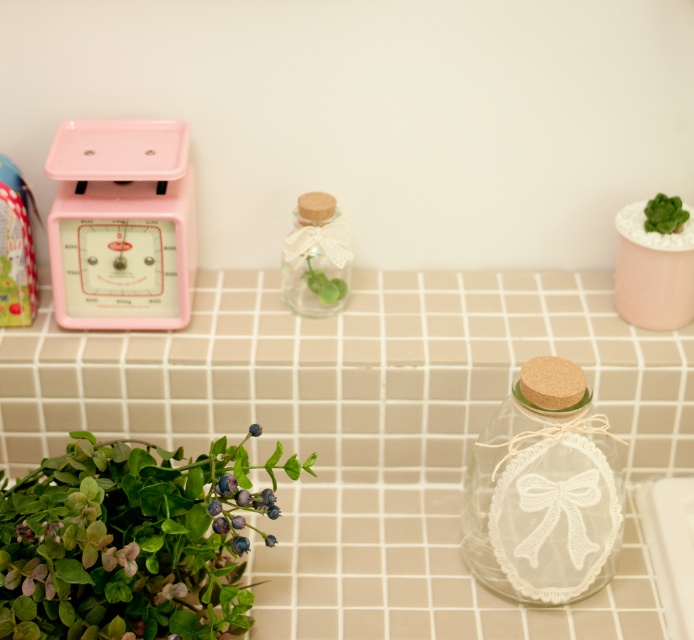
Question: Does green matte plant at lower left have a larger size compared to clear glass bottle at center?

Choices:
 (A) no
 (B) yes

Answer: (B)

Question: Which object is farther from the camera taking this photo?

Choices:
 (A) transparent glass jar with lace bow at center
 (B) green matte plant at lower left
 (C) green leafy plant at upper right
 (D) clear glass bottle at center

Answer: (D)

Question: Which point is farther to the camera?

Choices:
 (A) clear glass bottle at center
 (B) green matte plant at lower left
 (C) white grid tile counter at center
 (D) transparent glass jar with lace bow at center

Answer: (A)

Question: Which point is closer to the camera taking this photo?

Choices:
 (A) (384, 589)
 (B) (555, 584)

Answer: (B)

Question: Is transparent glass jar with lace bow at center above green leafy plant at upper right?

Choices:
 (A) yes
 (B) no

Answer: (B)

Question: Does green matte plant at lower left come in front of transparent glass jar with lace bow at center?

Choices:
 (A) yes
 (B) no

Answer: (A)